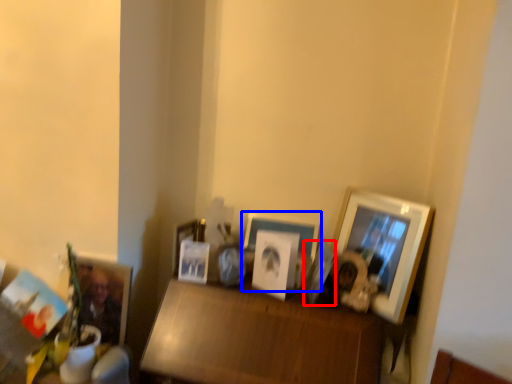
Question: Which object is further to the camera taking this photo, picture frame (highlighted by a red box) or picture frame (highlighted by a blue box)?

Choices:
 (A) picture frame
 (B) picture frame

Answer: (B)